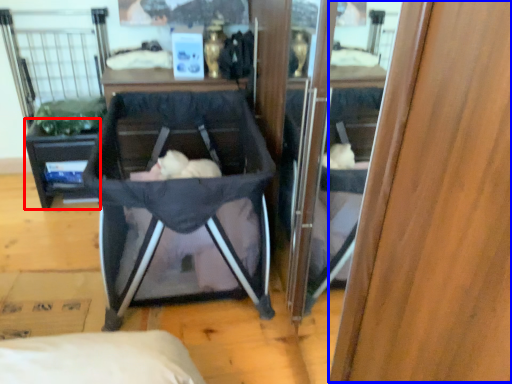
Question: Which object is closer to the camera taking this photo, vanity (highlighted by a red box) or wood (highlighted by a blue box)?

Choices:
 (A) vanity
 (B) wood

Answer: (B)